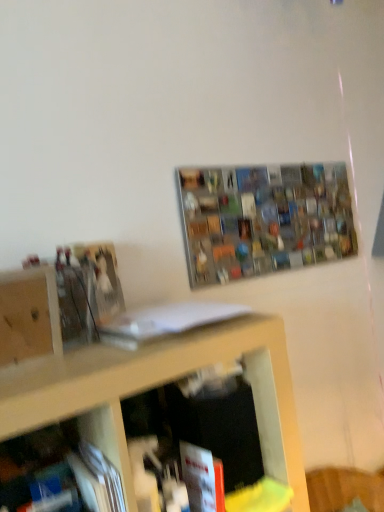
Question: Looking at their shapes, would you say wooden cabinet at left is wider or thinner than red matte book at lower center, the second book viewed from the top?

Choices:
 (A) thin
 (B) wide

Answer: (A)

Question: Is wooden cabinet at left inside the boundaries of red matte book at lower center, the second book viewed from the top, or outside?

Choices:
 (A) inside
 (B) outside

Answer: (B)

Question: Which is nearer to the white matte book at center, arranged as the second book when ordered from the bottom?

Choices:
 (A) wooden cabinet at left
 (B) metallic grid at upper center
 (C) red matte book at lower center, which ranks as the 1th book in bottom-to-top order

Answer: (A)

Question: Which of these objects is positioned farthest from the red matte book at lower center, which ranks as the 1th book in bottom-to-top order?

Choices:
 (A) metallic grid at upper center
 (B) wooden cabinet at left
 (C) white matte book at center, arranged as the second book when ordered from the bottom

Answer: (A)